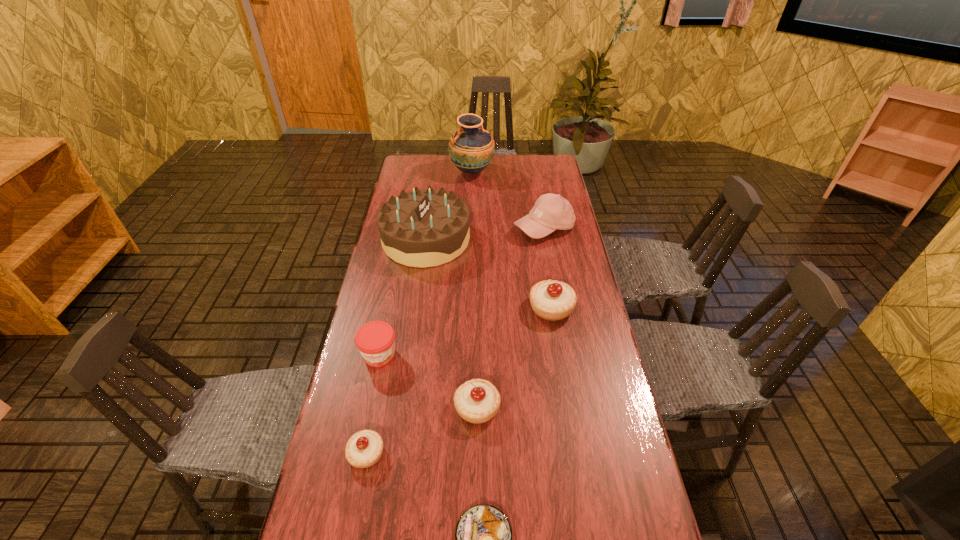
At what (x,y) coordinates should I click in order to perform the action: click on free space at the far left corner. Please return your answer as a coordinate pair (x, y). Image resolution: width=960 pixels, height=540 pixels. Looking at the image, I should click on (413, 173).

This screenshot has height=540, width=960. Identify the location of unoccupied position between the farthest beige pastry and the jam. (466, 332).

Find the location of a particular element. free spot between the pottery and the baseball cap is located at coordinates (508, 200).

What are the coordinates of `vacant region between the fourth nearest object and the brown birthday cake` in the screenshot? It's located at (402, 297).

This screenshot has width=960, height=540. What are the coordinates of `vacant space in between the jam and the pink baseball cap` in the screenshot? It's located at (462, 292).

Locate an element on the screen. The height and width of the screenshot is (540, 960). vacant space in between the farthest object and the rightmost pastry is located at coordinates (512, 240).

In order to click on the third closest object relative to the farthest pastry in this screenshot , I will do `click(551, 211)`.

Locate which object is the third closest to the second farthest beige pastry. Please provide its 2D coordinates. Your answer should be formatted as a tuple, i.e. [(x, y)], where the tuple contains the x and y coordinates of a point satisfying the conditions above.

[(483, 538)]

The image size is (960, 540). Find the location of `the third closest pastry to the nearest object`. the third closest pastry to the nearest object is located at coordinates (552, 300).

Locate which pastry is the fourth closest to the pottery. Please provide its 2D coordinates. Your answer should be formatted as a tuple, i.e. [(x, y)], where the tuple contains the x and y coordinates of a point satisfying the conditions above.

[(483, 538)]